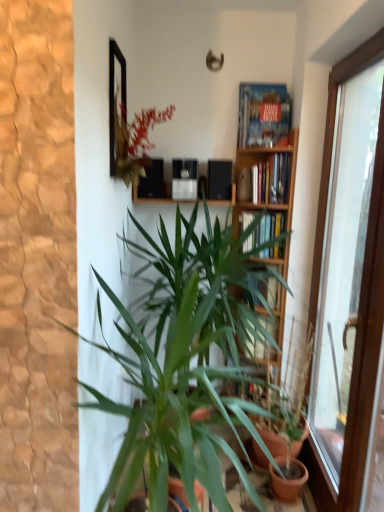
Question: Does matte black speakers at upper center have a greater width compared to transparent glass door at right?

Choices:
 (A) yes
 (B) no

Answer: (A)

Question: Does matte black speakers at upper center have a lesser height compared to transparent glass door at right?

Choices:
 (A) no
 (B) yes

Answer: (B)

Question: Would you say transparent glass door at right is part of matte black speakers at upper center's contents?

Choices:
 (A) no
 (B) yes

Answer: (A)

Question: Could you tell me if matte black speakers at upper center is facing transparent glass door at right?

Choices:
 (A) no
 (B) yes

Answer: (A)

Question: Is matte black speakers at upper center oriented away from transparent glass door at right?

Choices:
 (A) yes
 (B) no

Answer: (B)

Question: Is point (288, 124) positioned closer to the camera than point (162, 184)?

Choices:
 (A) farther
 (B) closer

Answer: (B)

Question: From the image's perspective, relative to matte black speakers at upper center, is wooden bookshelf at center above or below?

Choices:
 (A) above
 (B) below

Answer: (B)

Question: Considering their positions, is wooden bookshelf at center located in front of or behind matte black speakers at upper center?

Choices:
 (A) behind
 (B) front

Answer: (B)

Question: Visually, is wooden bookshelf at center positioned to the left or to the right of matte black speakers at upper center?

Choices:
 (A) right
 (B) left

Answer: (A)

Question: In terms of height, does wooden bookshelf at center look taller or shorter compared to wooden bookshelf at upper center, the second book positioned from the bottom?

Choices:
 (A) short
 (B) tall

Answer: (B)

Question: From the image's perspective, is wooden bookshelf at center above or below wooden bookshelf at upper center, the second book positioned from the bottom?

Choices:
 (A) below
 (B) above

Answer: (A)

Question: Is wooden bookshelf at center in front of or behind wooden bookshelf at upper center, marked as the 2th book in a top-to-bottom arrangement, in the image?

Choices:
 (A) front
 (B) behind

Answer: (A)

Question: Is wooden bookshelf at center spatially inside wooden bookshelf at upper center, marked as the 2th book in a top-to-bottom arrangement, or outside of it?

Choices:
 (A) outside
 (B) inside

Answer: (A)

Question: Choose the correct answer: Is wooden bookshelf at upper center, the second book positioned from the bottom, inside hardcover books at center, acting as the 3th book starting from the top, or outside it?

Choices:
 (A) inside
 (B) outside

Answer: (B)

Question: Does point (286, 161) appear closer or farther from the camera than point (244, 228)?

Choices:
 (A) farther
 (B) closer

Answer: (B)